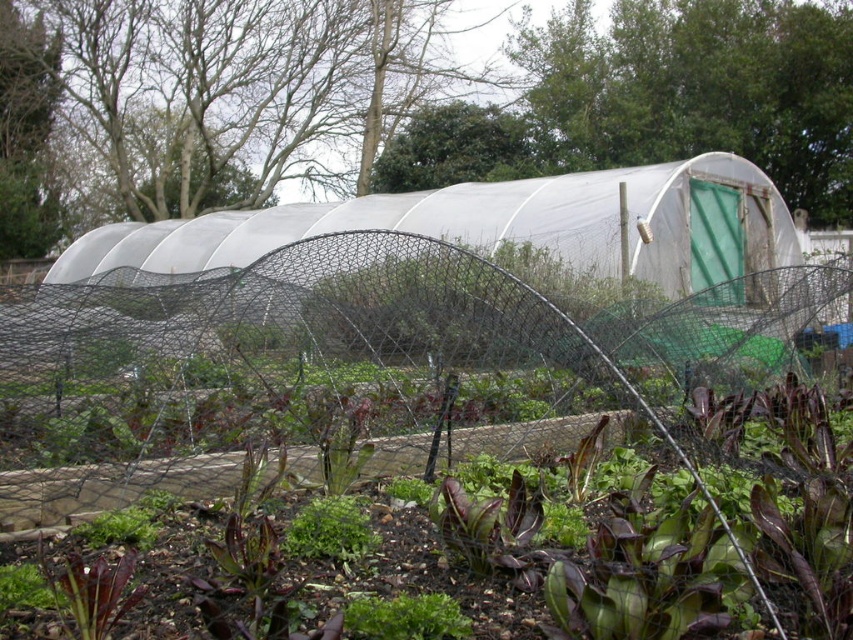
Can you confirm if green leafy at center is shorter than green leafy plant at center?

Yes.

Consider the image. Is green leafy at center bigger than green leafy plant at center?

No.

Is point (407, 600) farther from camera compared to point (346, 497)?

No, it is not.

Where is `green leafy at center`? green leafy at center is located at coordinates (405, 618).

Consider the image. Is green mesh netting at center shorter than green leafy plant at center?

No, green mesh netting at center is not shorter than green leafy plant at center.

Between green mesh netting at center and green leafy plant at center, which one has more height?

green mesh netting at center

Who is more distant from viewer, (448,244) or (363,548)?

Positioned behind is point (448,244).

I want to click on green mesh netting at center, so click(x=355, y=372).

Between green mesh netting at center and green leafy at center, which one has more height?

With more height is green mesh netting at center.

Consider the image. Who is higher up, green mesh netting at center or green leafy at center?

Positioned higher is green mesh netting at center.

Is point (65, 349) positioned behind point (425, 620)?

Yes, it is.

This screenshot has height=640, width=853. Find the location of `green mesh netting at center`. green mesh netting at center is located at coordinates (355, 372).